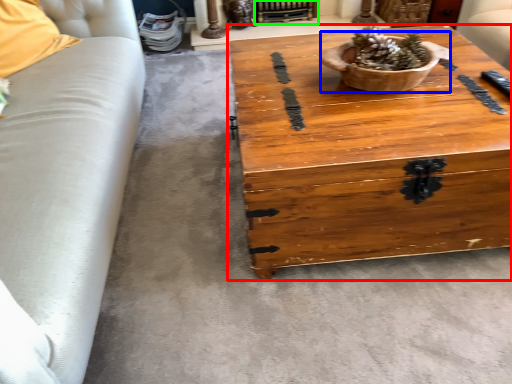
Question: Estimate the real-world distances between objects in this image. Which object is farther from coffee table (highlighted by a red box), flowerpot (highlighted by a blue box) or fireplace (highlighted by a green box)?

Choices:
 (A) flowerpot
 (B) fireplace

Answer: (B)